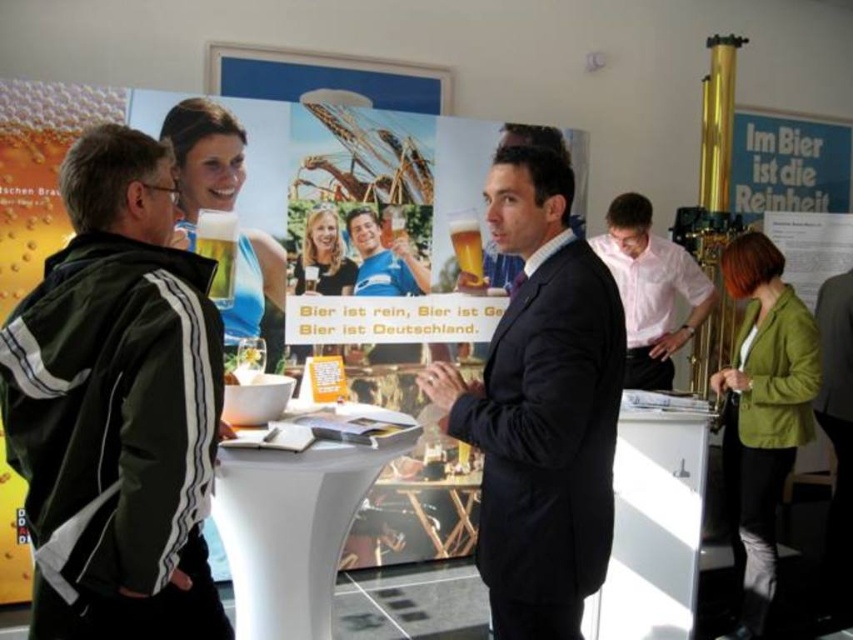
Question: Does green fabric jacket at left have a greater width compared to dark suit at center?

Choices:
 (A) no
 (B) yes

Answer: (A)

Question: Among these objects, which one is farthest from the camera?

Choices:
 (A) green fabric jacket at left
 (B) matte black jacket at center

Answer: (B)

Question: Is green cotton jacket at lower right in front of dark gray suit at center?

Choices:
 (A) no
 (B) yes

Answer: (B)

Question: Can you confirm if dark suit at center is thinner than dark gray suit at center?

Choices:
 (A) yes
 (B) no

Answer: (A)

Question: Which of the following is the farthest from the observer?

Choices:
 (A) (519, 408)
 (B) (740, 452)
 (C) (321, 292)

Answer: (C)

Question: Which of these objects is positioned farthest from the dark gray suit at center?

Choices:
 (A) dark suit at center
 (B) green fabric jacket at left
 (C) pink cotton shirt at center

Answer: (B)